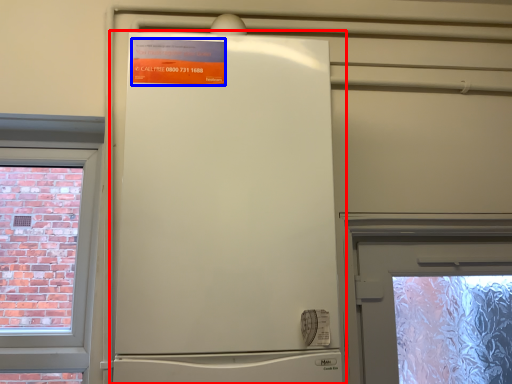
Question: Among these objects, which one is farthest to the camera, refrigerator (highlighted by a red box) or poster (highlighted by a blue box)?

Choices:
 (A) refrigerator
 (B) poster

Answer: (B)